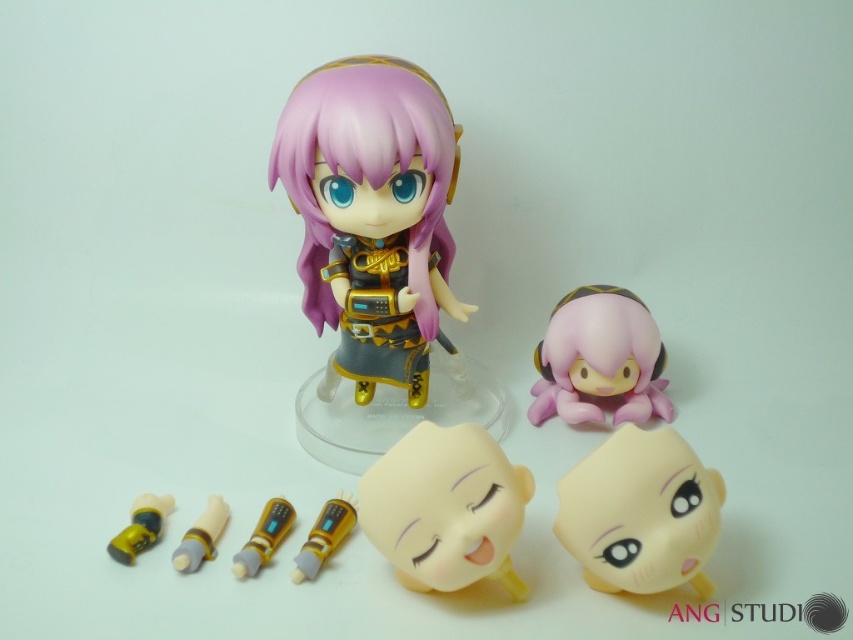
Who is shorter, purple matte hair at center or matte yellow plastic toy at lower left?

Standing shorter between the two is matte yellow plastic toy at lower left.

Which of these two, purple matte hair at center or matte yellow plastic toy at lower left, stands taller?

With more height is purple matte hair at center.

Locate an element on the screen. The width and height of the screenshot is (853, 640). purple matte hair at center is located at coordinates (367, 164).

The image size is (853, 640). I want to click on purple matte hair at center, so click(367, 164).

Can you confirm if purple matte hair at center is positioned to the left of gold metallic tube at center?

In fact, purple matte hair at center is to the right of gold metallic tube at center.

Find the location of `purple matte hair at center`. purple matte hair at center is located at coordinates (367, 164).

Between purple matte hair at center and smooth yellow plush at center, which one is positioned lower?

smooth yellow plush at center is lower down.

Does purple matte hair at center appear over smooth yellow plush at center?

Yes.

Does point (357, 76) come farther from viewer compared to point (517, 508)?

Yes, it is behind point (517, 508).

You are a GUI agent. You are given a task and a screenshot of the screen. Output one action in this format:
    pyautogui.click(x=<x>, y=<y>)
    Task: Click on the purple matte hair at center
    
    Given the screenshot: What is the action you would take?
    pyautogui.click(x=367, y=164)